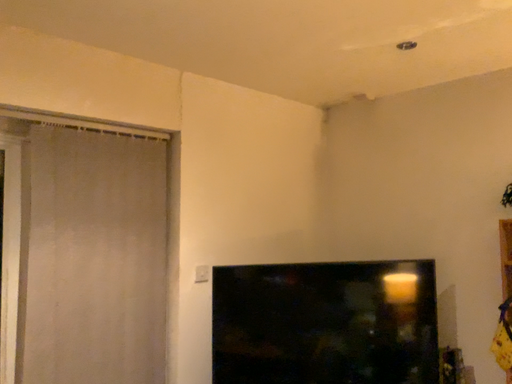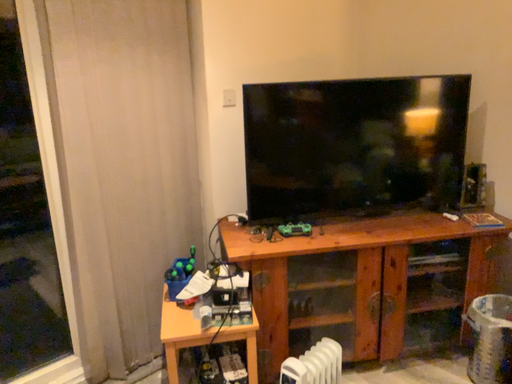
Question: Which way did the camera rotate in the video?

Choices:
 (A) rotated upward
 (B) rotated downward

Answer: (B)